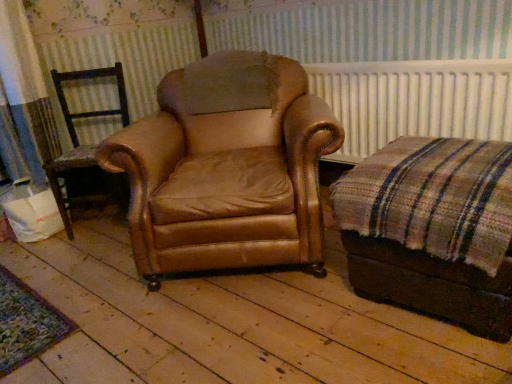
How much space does leather armchair at center, placed as the 2th chair when sorted from left to right, occupy vertically?

The height of leather armchair at center, placed as the 2th chair when sorted from left to right, is 33.44 inches.

Where is `plaid fabric ottoman at right`? plaid fabric ottoman at right is located at coordinates 433,229.

Which is more to the left, leather armchair at center, placed as the 2th chair when sorted from left to right, or brown leather chair at left, which appears as the 1th chair when viewed from the left?

brown leather chair at left, which appears as the 1th chair when viewed from the left.

Looking at the image, does leather armchair at center, which is counted as the first chair, starting from the right, seem bigger or smaller compared to brown leather chair at left, which is counted as the 2th chair, starting from the right?

Considering their sizes, leather armchair at center, which is counted as the first chair, starting from the right, takes up more space than brown leather chair at left, which is counted as the 2th chair, starting from the right.

Choose the correct answer: Is leather armchair at center, which is counted as the first chair, starting from the right, inside brown leather chair at left, which appears as the 1th chair when viewed from the left, or outside it?

The correct answer is: outside.

Is leather armchair at center, placed as the 2th chair when sorted from left to right, positioned with its back to brown leather chair at left, which appears as the 1th chair when viewed from the left?

No, leather armchair at center, placed as the 2th chair when sorted from left to right,'s orientation is not away from brown leather chair at left, which appears as the 1th chair when viewed from the left.

Is plaid fabric ottoman at right not near brown leather chair at left, which appears as the 1th chair when viewed from the left?

plaid fabric ottoman at right is positioned a significant distance from brown leather chair at left, which appears as the 1th chair when viewed from the left.

Is plaid fabric ottoman at right looking in the opposite direction of brown leather chair at left, which is counted as the 2th chair, starting from the right?

No, brown leather chair at left, which is counted as the 2th chair, starting from the right, is not at the back of plaid fabric ottoman at right.

From the image's perspective, which one is positioned lower, plaid fabric ottoman at right or brown leather chair at left, which is counted as the 2th chair, starting from the right?

From the image's view, plaid fabric ottoman at right is below.

Is plaid fabric ottoman at right smaller than brown leather chair at left, which appears as the 1th chair when viewed from the left?

Incorrect, plaid fabric ottoman at right is not smaller in size than brown leather chair at left, which appears as the 1th chair when viewed from the left.

From a real-world perspective, is leather armchair at center, placed as the 2th chair when sorted from left to right, above or below white radiator at upper center?

leather armchair at center, placed as the 2th chair when sorted from left to right, is below white radiator at upper center.

Which point is more distant from viewer, (158,242) or (382,128)?

The point (382,128) is more distant.

Find the location of a particular element. chair in front of the white radiator at upper center is located at coordinates (226, 167).

Looking at this image, who is shorter, leather armchair at center, which is counted as the first chair, starting from the right, or white radiator at upper center?

With less height is white radiator at upper center.

Considering the sizes of objects brown leather chair at left, which is counted as the 2th chair, starting from the right, and white radiator at upper center in the image provided, who is smaller, brown leather chair at left, which is counted as the 2th chair, starting from the right, or white radiator at upper center?

white radiator at upper center.

What's the angular difference between brown leather chair at left, which appears as the 1th chair when viewed from the left, and white radiator at upper center's facing directions?

The angular difference between brown leather chair at left, which appears as the 1th chair when viewed from the left, and white radiator at upper center is 41.5 degrees.

Can you confirm if brown leather chair at left, which is counted as the 2th chair, starting from the right, is taller than white radiator at upper center?

Indeed, brown leather chair at left, which is counted as the 2th chair, starting from the right, has a greater height compared to white radiator at upper center.

From a real-world perspective, relative to white radiator at upper center, is brown leather chair at left, which appears as the 1th chair when viewed from the left, vertically above or below?

Clearly, from a real-world perspective, brown leather chair at left, which appears as the 1th chair when viewed from the left, is below white radiator at upper center.

In the image, is brown leather chair at left, which appears as the 1th chair when viewed from the left, positioned in front of or behind plaid fabric ottoman at right?

Clearly, brown leather chair at left, which appears as the 1th chair when viewed from the left, is behind plaid fabric ottoman at right.

Who is shorter, brown leather chair at left, which is counted as the 2th chair, starting from the right, or plaid fabric ottoman at right?

plaid fabric ottoman at right is shorter.

Between brown leather chair at left, which appears as the 1th chair when viewed from the left, and plaid fabric ottoman at right, which one appears on the left side from the viewer's perspective?

Positioned to the left is brown leather chair at left, which appears as the 1th chair when viewed from the left.

From a real-world perspective, which object stands above the other?

brown leather chair at left, which appears as the 1th chair when viewed from the left, from a real-world perspective.

Between white radiator at upper center and brown leather chair at left, which appears as the 1th chair when viewed from the left, which one has larger width?

brown leather chair at left, which appears as the 1th chair when viewed from the left.

Find the location of `chair that is the 1st object located below the white radiator at upper center (from the image's perspective)`. chair that is the 1st object located below the white radiator at upper center (from the image's perspective) is located at coordinates (77, 136).

How many degrees apart are the facing directions of white radiator at upper center and brown leather chair at left, which is counted as the 2th chair, starting from the right?

white radiator at upper center and brown leather chair at left, which is counted as the 2th chair, starting from the right, are facing 41.5 degrees away from each other.

Is brown leather chair at left, which appears as the 1th chair when viewed from the left, beside leather armchair at center, which is counted as the first chair, starting from the right?

No, brown leather chair at left, which appears as the 1th chair when viewed from the left, is not making contact with leather armchair at center, which is counted as the first chair, starting from the right.

Considering the relative sizes of brown leather chair at left, which is counted as the 2th chair, starting from the right, and leather armchair at center, placed as the 2th chair when sorted from left to right, in the image provided, is brown leather chair at left, which is counted as the 2th chair, starting from the right, thinner than leather armchair at center, placed as the 2th chair when sorted from left to right,?

Indeed, brown leather chair at left, which is counted as the 2th chair, starting from the right, has a lesser width compared to leather armchair at center, placed as the 2th chair when sorted from left to right.

Based on the photo, between brown leather chair at left, which appears as the 1th chair when viewed from the left, and leather armchair at center, placed as the 2th chair when sorted from left to right, which one has smaller size?

brown leather chair at left, which appears as the 1th chair when viewed from the left, is smaller.

Where is `chair located on the right of brown leather chair at left, which appears as the 1th chair when viewed from the left`? chair located on the right of brown leather chair at left, which appears as the 1th chair when viewed from the left is located at coordinates (226, 167).

From the image's perspective, which chair is the 2nd one above the plaid fabric ottoman at right? Please provide its 2D coordinates.

[(77, 136)]

Based on their spatial positions, is plaid fabric ottoman at right or leather armchair at center, placed as the 2th chair when sorted from left to right, closer to white radiator at upper center?

leather armchair at center, placed as the 2th chair when sorted from left to right, lies closer to white radiator at upper center than the other object.

Looking at the image, which one is located further to brown leather chair at left, which appears as the 1th chair when viewed from the left, plaid fabric ottoman at right or leather armchair at center, which is counted as the first chair, starting from the right?

Among the two, plaid fabric ottoman at right is located further to brown leather chair at left, which appears as the 1th chair when viewed from the left.

Which object lies nearer to the anchor point brown leather chair at left, which appears as the 1th chair when viewed from the left, white radiator at upper center or leather armchair at center, placed as the 2th chair when sorted from left to right?

leather armchair at center, placed as the 2th chair when sorted from left to right, is positioned closer to the anchor brown leather chair at left, which appears as the 1th chair when viewed from the left.

From the image, which object appears to be farther from brown leather chair at left, which is counted as the 2th chair, starting from the right, white radiator at upper center or plaid fabric ottoman at right?

plaid fabric ottoman at right lies further to brown leather chair at left, which is counted as the 2th chair, starting from the right, than the other object.

Which object lies nearer to the anchor point plaid fabric ottoman at right, brown leather chair at left, which is counted as the 2th chair, starting from the right, or leather armchair at center, which is counted as the first chair, starting from the right?

leather armchair at center, which is counted as the first chair, starting from the right.

Estimate the real-world distances between objects in this image. Which object is closer to brown leather chair at left, which appears as the 1th chair when viewed from the left, leather armchair at center, placed as the 2th chair when sorted from left to right, or white radiator at upper center?

leather armchair at center, placed as the 2th chair when sorted from left to right, lies closer to brown leather chair at left, which appears as the 1th chair when viewed from the left, than the other object.

When comparing their distances from white radiator at upper center, does plaid fabric ottoman at right or brown leather chair at left, which appears as the 1th chair when viewed from the left, seem further?

brown leather chair at left, which appears as the 1th chair when viewed from the left, is further to white radiator at upper center.

Based on the photo, estimate the real-world distances between objects in this image. Which object is further from white radiator at upper center, leather armchair at center, placed as the 2th chair when sorted from left to right, or plaid fabric ottoman at right?

Among the two, plaid fabric ottoman at right is located further to white radiator at upper center.

Identify the location of chair between brown leather chair at left, which is counted as the 2th chair, starting from the right, and white radiator at upper center, in the horizontal direction. tap(226, 167).

This screenshot has height=384, width=512. In order to click on radiator between brown leather chair at left, which is counted as the 2th chair, starting from the right, and plaid fabric ottoman at right, in the horizontal direction in this screenshot , I will do [414, 101].

I want to click on chair between brown leather chair at left, which is counted as the 2th chair, starting from the right, and plaid fabric ottoman at right, so click(x=226, y=167).

The image size is (512, 384). Find the location of `radiator between leather armchair at center, placed as the 2th chair when sorted from left to right, and plaid fabric ottoman at right, in the horizontal direction`. radiator between leather armchair at center, placed as the 2th chair when sorted from left to right, and plaid fabric ottoman at right, in the horizontal direction is located at coordinates (414, 101).